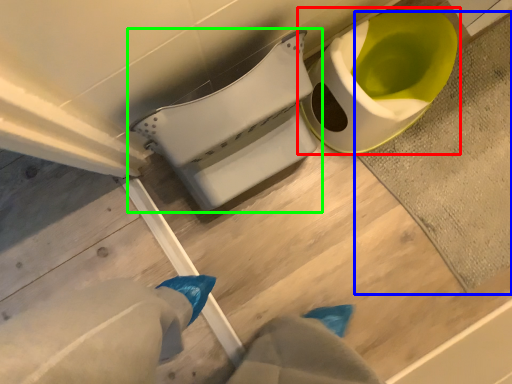
Question: Based on their relative distances, which object is nearer to toilet (highlighted by a red box)? Choose from bath mat (highlighted by a blue box) and toilet (highlighted by a green box).

Choices:
 (A) bath mat
 (B) toilet

Answer: (A)